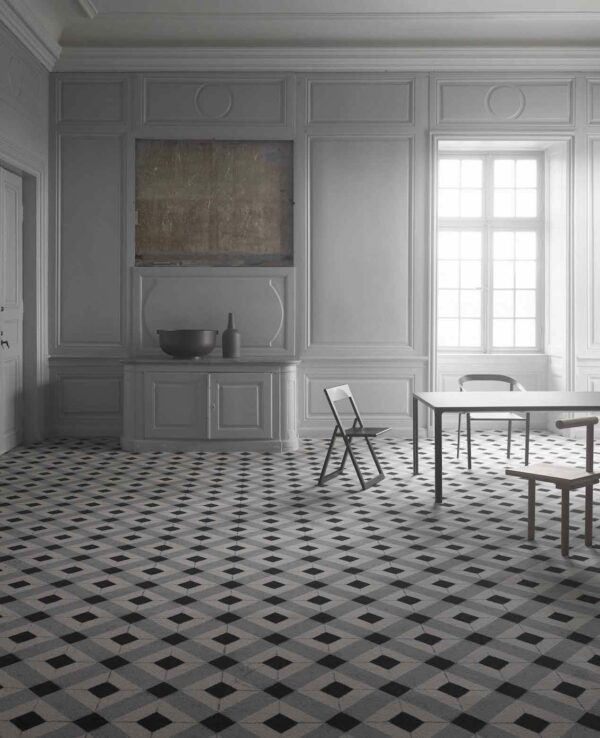
The image size is (600, 738). I want to click on window frame, so click(x=540, y=218).